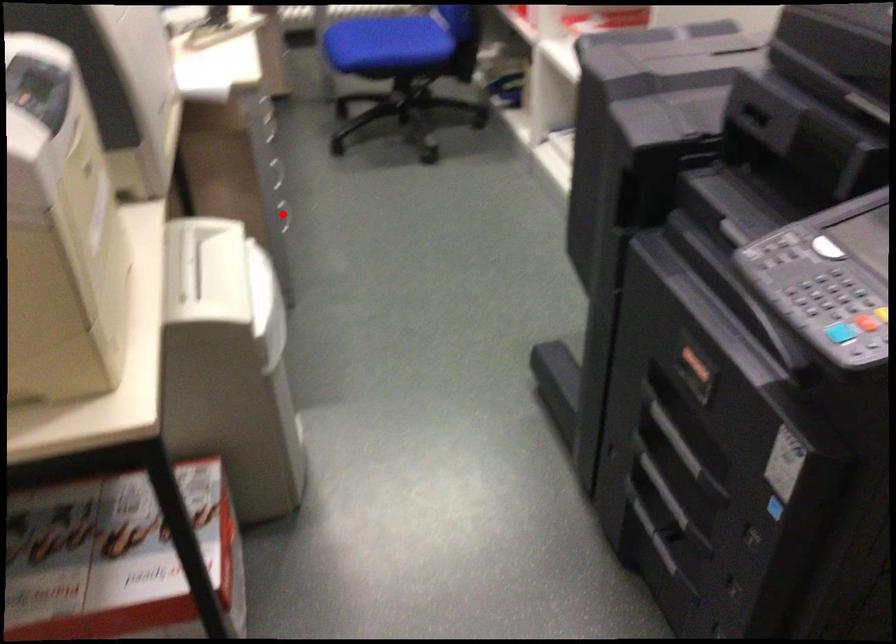
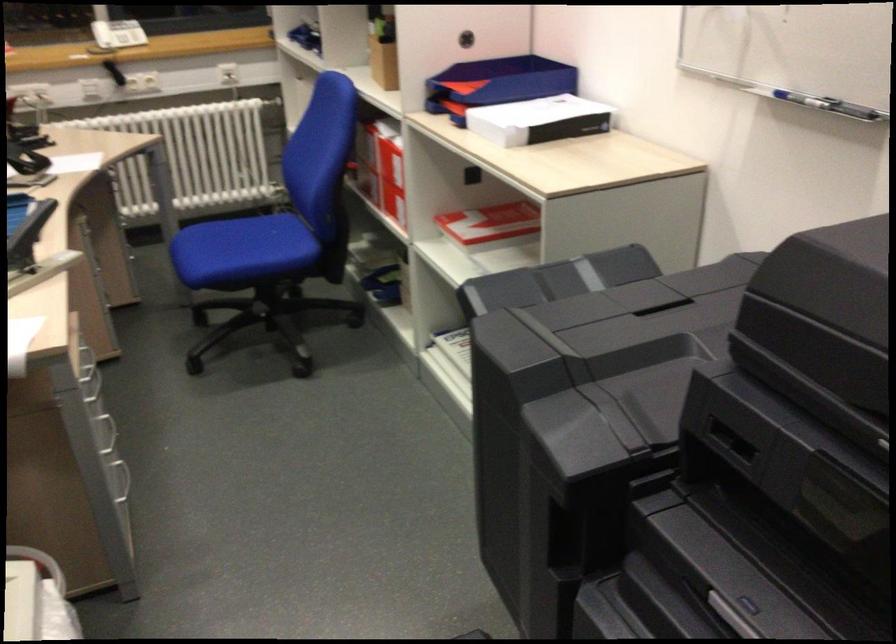
Question: I am providing you with two images of the same scene from different viewpoints. Given a red point in image1, look at the same physical point in image2. Is it:

Choices:
 (A) Closer to the viewpoint
 (B) Farther from the viewpoint

Answer: (A)